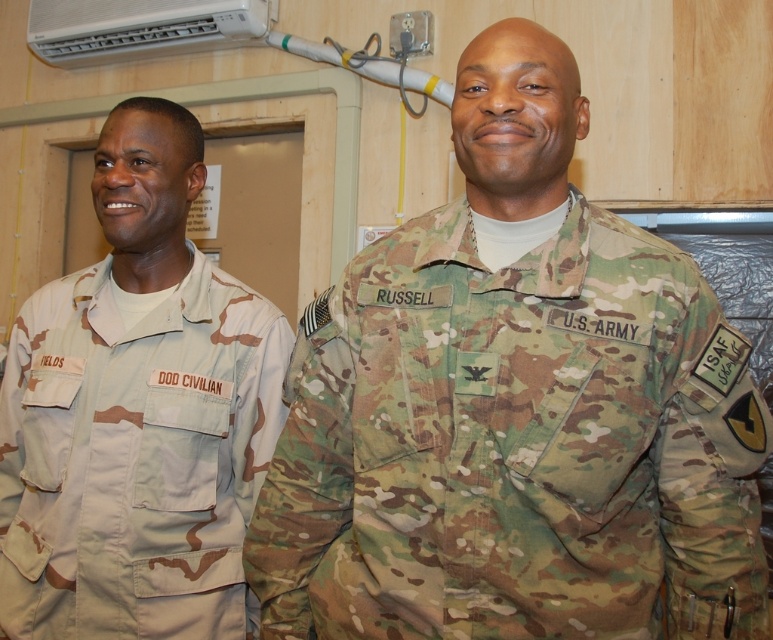
Question: Which point appears farthest from the camera in this image?

Choices:
 (A) (63, 500)
 (B) (247, 8)
 (C) (523, 259)

Answer: (B)

Question: Does tan camouflage uniform at left have a lesser width compared to white plastic air conditioner at upper center?

Choices:
 (A) no
 (B) yes

Answer: (B)

Question: Is camo fabric us army uniform at center further to the viewer compared to white plastic air conditioner at upper center?

Choices:
 (A) no
 (B) yes

Answer: (A)

Question: Is tan camouflage uniform at left below white plastic air conditioner at upper center?

Choices:
 (A) yes
 (B) no

Answer: (A)

Question: Which object appears farthest from the camera in this image?

Choices:
 (A) white plastic air conditioner at upper center
 (B) tan camouflage uniform at left

Answer: (A)

Question: Which object is closer to the camera taking this photo?

Choices:
 (A) tan camouflage uniform at left
 (B) white plastic air conditioner at upper center

Answer: (A)